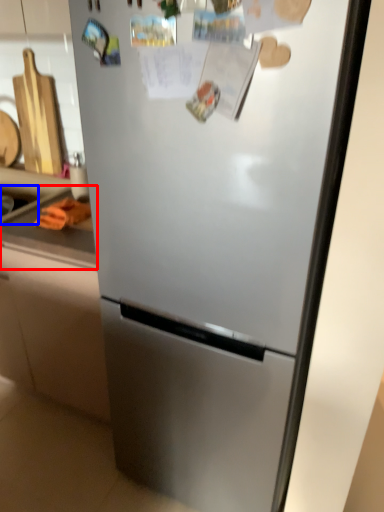
Question: Which object is closer to the camera taking this photo, counter top (highlighted by a red box) or sink (highlighted by a blue box)?

Choices:
 (A) counter top
 (B) sink

Answer: (A)